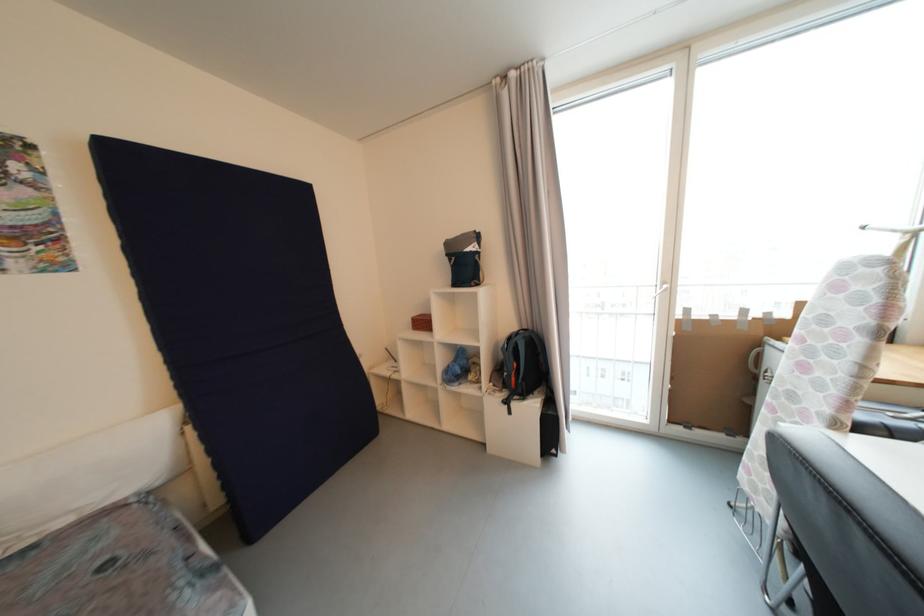
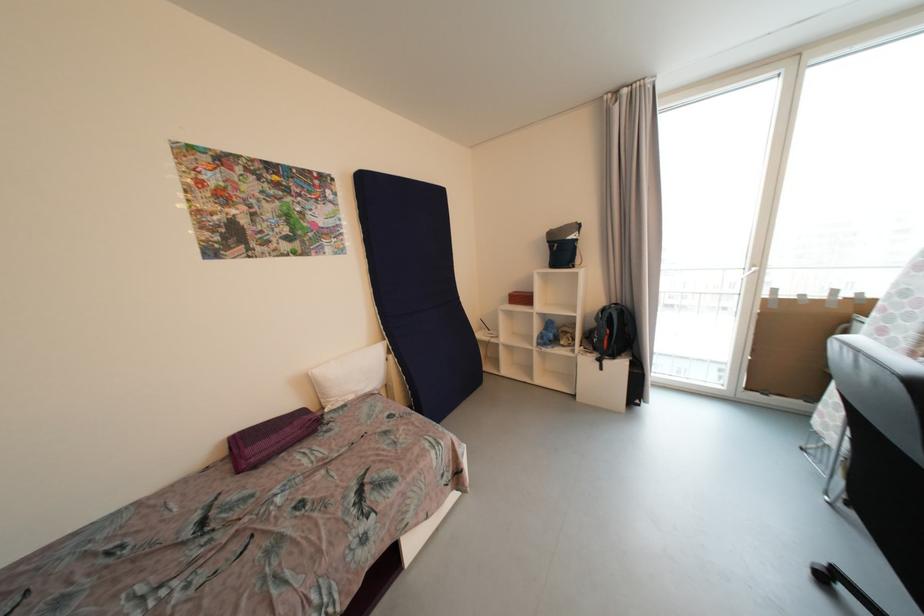
Where in the second image is the point corresponding to the point at 195,431 from the first image?

(396, 359)